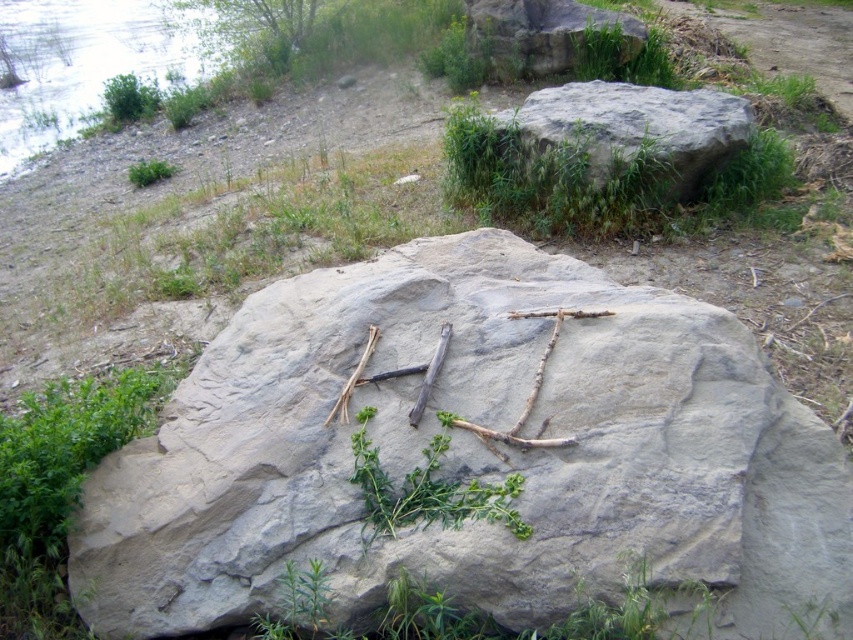
You are standing in the outdoor scene and want to walk from the gray rock at upper center to the green leafy tree at upper left. Which direction should you head to get closer to the tree?

Since the gray rock at upper center is closer to you than the green leafy tree at upper left, you should head towards the direction of the tree to move away from the rock and closer to the tree.

You are standing in the outdoor scene and want to walk from the gray rock at upper center to the green leafy tree at upper left. Which direction should you face to walk directly towards the tree?

You should face to the left because the gray rock at upper center is positioned to the right of the green leafy tree at upper left, so walking left would lead directly towards the tree.